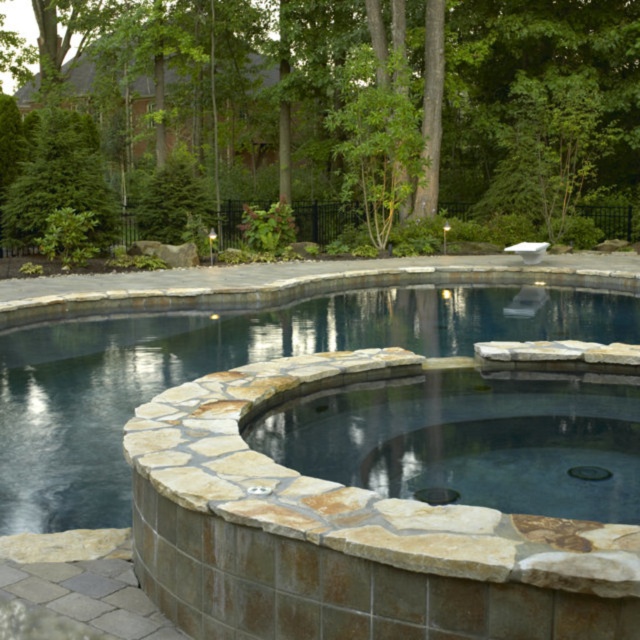
Question: Which object is the closest to the natural stone hot tub at center?

Choices:
 (A) green leafy tree at upper center
 (B) natural stone pool at center

Answer: (B)

Question: Among these objects, which one is farthest from the camera?

Choices:
 (A) natural stone hot tub at center
 (B) green leafy tree at upper center

Answer: (B)

Question: Can you confirm if green leafy tree at upper center is positioned below natural stone pool at center?

Choices:
 (A) yes
 (B) no

Answer: (B)

Question: Which point appears closest to the camera in this image?

Choices:
 (A) (426, 499)
 (B) (68, 74)
 (C) (8, 516)

Answer: (A)

Question: Where is natural stone pool at center located in relation to natural stone hot tub at center in the image?

Choices:
 (A) above
 (B) below

Answer: (A)

Question: Does green leafy tree at upper center have a larger size compared to natural stone hot tub at center?

Choices:
 (A) no
 (B) yes

Answer: (B)